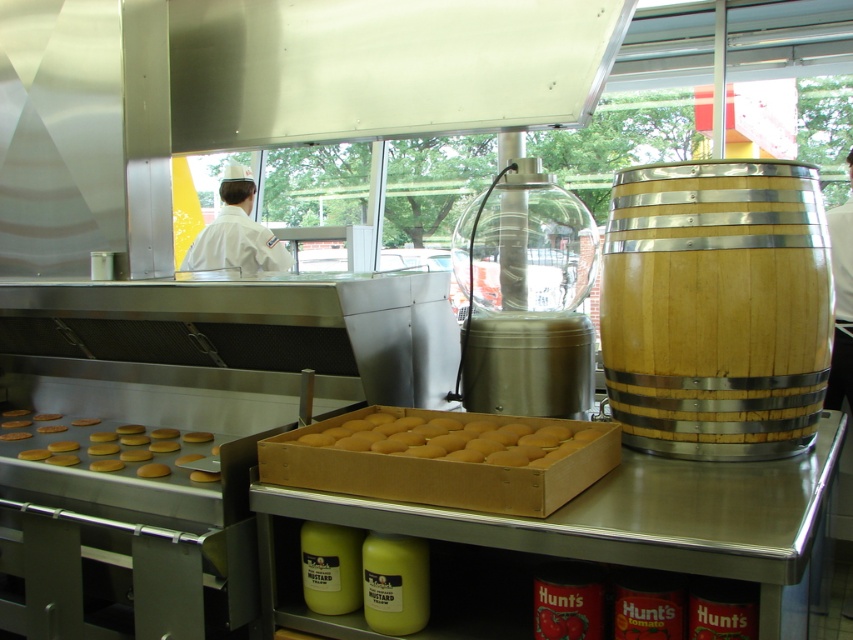
Question: Which point is farther to the camera?

Choices:
 (A) (723, 381)
 (B) (142, 472)

Answer: (B)

Question: Which point appears farthest from the camera in this image?

Choices:
 (A) (723, 259)
 (B) (444, 433)

Answer: (B)

Question: In this image, where is golden matte buns at center located relative to golden matte hamburger buns at lower left?

Choices:
 (A) above
 (B) below

Answer: (A)

Question: Is the position of white uniform at center less distant than that of golden matte hamburger buns at lower left?

Choices:
 (A) yes
 (B) no

Answer: (B)

Question: Does golden matte buns at center have a greater width compared to golden matte hamburger buns at lower left?

Choices:
 (A) yes
 (B) no

Answer: (A)

Question: Which object appears closest to the camera in this image?

Choices:
 (A) golden matte cookies at lower left
 (B) golden matte cookies at center
 (C) golden matte hamburger buns at lower left
 (D) golden matte buns at center

Answer: (D)